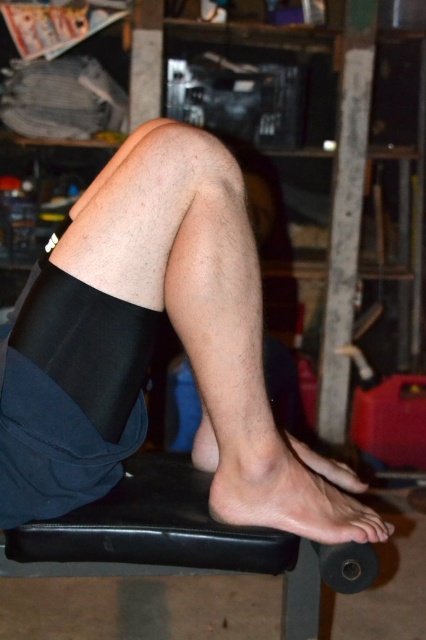
Question: Estimate the real-world distances between objects in this image. Which object is farther from the black rubber stool at lower center?

Choices:
 (A) skinny barefoot at lower center
 (B) black matte knee brace at center

Answer: (B)

Question: Does hairless skin at center appear under black rubber stool at lower center?

Choices:
 (A) yes
 (B) no

Answer: (B)

Question: Observing the image, what is the correct spatial positioning of hairless skin at center in reference to skinny barefoot at lower center?

Choices:
 (A) right
 (B) left

Answer: (B)

Question: Does hairless skin at center appear on the right side of black rubber stool at lower center?

Choices:
 (A) no
 (B) yes

Answer: (B)

Question: Which object is farther from the camera taking this photo?

Choices:
 (A) black rubber stool at lower center
 (B) hairless skin at center
 (C) skinny barefoot at lower center
 (D) black matte knee brace at center

Answer: (A)

Question: Which point appears closest to the camera in this image?

Choices:
 (A) (316, 481)
 (B) (9, 536)
 (C) (23, 484)

Answer: (C)